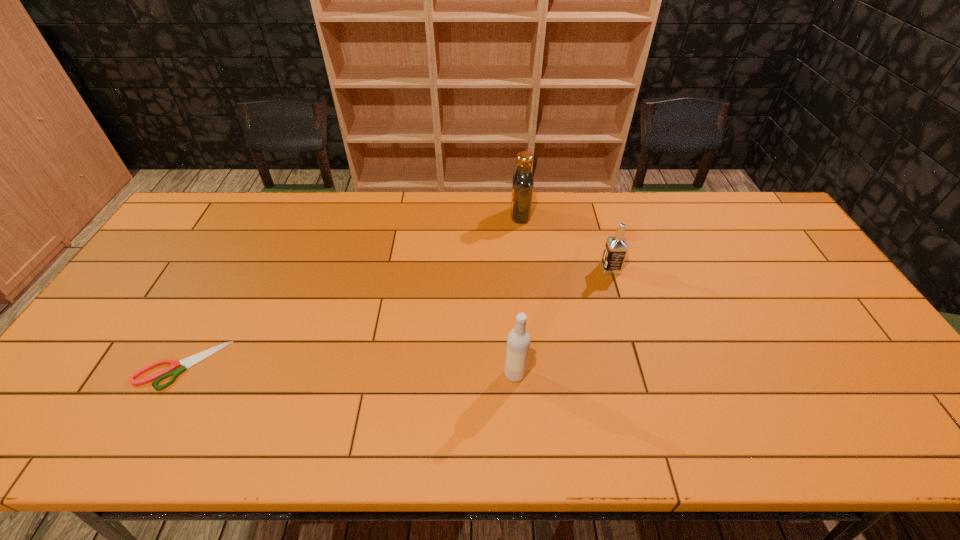
Find the location of `vacant space located on the front label of the third tallest object`. vacant space located on the front label of the third tallest object is located at coordinates (522, 268).

You are a GUI agent. You are given a task and a screenshot of the screen. Output one action in this format:
    pyautogui.click(x=<x>, y=<y>)
    Task: Click on the blank space located on the front label of the third tallest object
    This screenshot has height=540, width=960.
    Given the screenshot: What is the action you would take?
    pyautogui.click(x=499, y=268)

Identify the location of vacant space located 0.280m on the front label of the third tallest object. Image resolution: width=960 pixels, height=540 pixels. (509, 268).

Locate an element on the screen. This screenshot has height=540, width=960. vacant point located 0.110m on the left of the scissors is located at coordinates (96, 365).

Find the location of a particular element. object present at the far edge is located at coordinates (522, 182).

Find the location of `object that is at the left edge`. object that is at the left edge is located at coordinates (178, 367).

This screenshot has width=960, height=540. In the image, there is a desktop. In order to click on vacant space at the far edge in this screenshot , I will do `click(574, 201)`.

Locate an element on the screen. free region at the near edge of the desktop is located at coordinates (480, 436).

In the image, there is a desktop. Find the location of `vacant area at the right edge`. vacant area at the right edge is located at coordinates (860, 341).

Identify the location of empty location between the farthest vodka and the leftmost object. Image resolution: width=960 pixels, height=540 pixels. (351, 290).